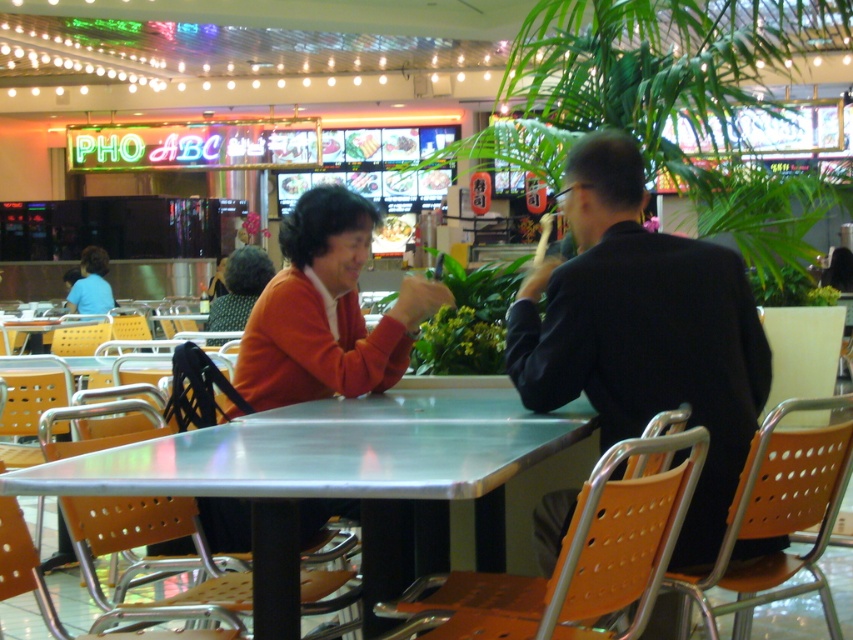
Question: Among these points, which one is nearest to the camera?

Choices:
 (A) (13, 572)
 (B) (71, 288)

Answer: (A)

Question: Can you confirm if black matte suit at center is positioned above orange perforated plastic chair at lower right?

Choices:
 (A) no
 (B) yes

Answer: (B)

Question: Estimate the real-world distances between objects in this image. Which object is closer to the orange perforated plastic chair at lower left?

Choices:
 (A) matte orange sweater at center
 (B) orange perforated plastic chair at lower right
 (C) metallic orange chair at lower left
 (D) light blue shirt at left

Answer: (A)

Question: Is orange perforated plastic chair at lower right smaller than orange perforated plastic chair at lower left?

Choices:
 (A) no
 (B) yes

Answer: (A)

Question: Is orange perforated plastic chair at lower center positioned behind light blue shirt at left?

Choices:
 (A) yes
 (B) no

Answer: (B)

Question: Based on their relative distances, which object is farther from the orange perforated plastic chair at lower left?

Choices:
 (A) black matte suit at center
 (B) metallic orange chair at lower left
 (C) metallic orange chair at center
 (D) orange perforated plastic chair at lower center

Answer: (D)